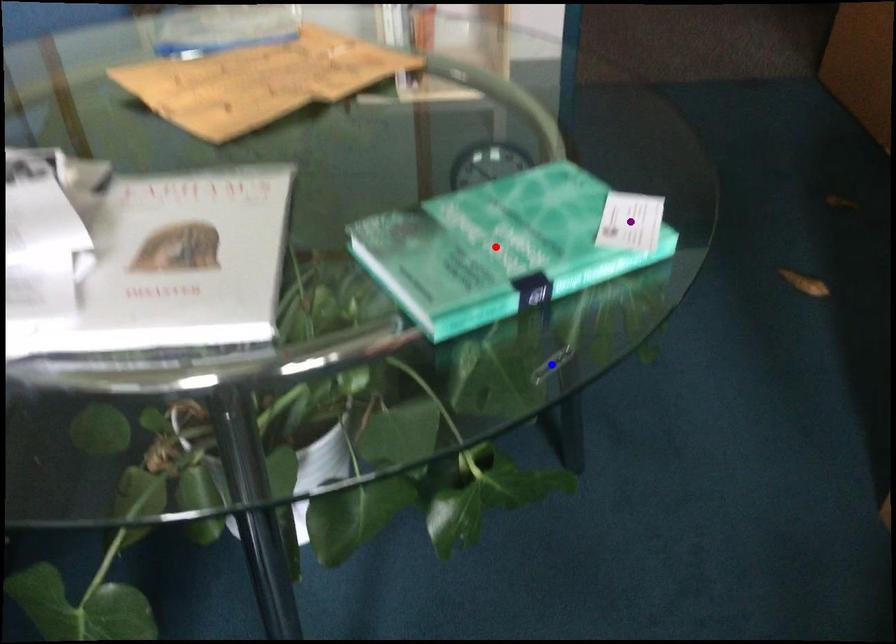
Order these from nearest to farthest:
red point
purple point
blue point

red point < purple point < blue point